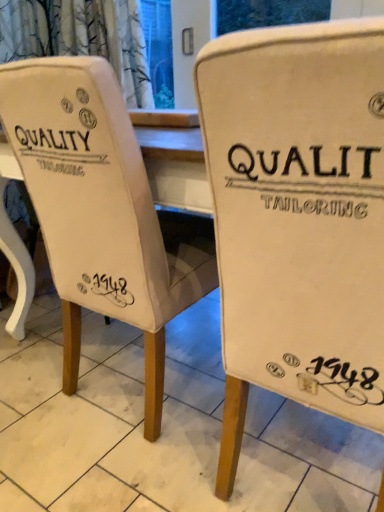
Question: Is white fabric chair at center, the second chair viewed from the right, positioned beyond the bounds of beige fabric chair at center, the first chair from the right?

Choices:
 (A) yes
 (B) no

Answer: (A)

Question: Does white fabric chair at center, the first chair in the left-to-right sequence, turn towards beige fabric chair at center, the first chair from the right?

Choices:
 (A) no
 (B) yes

Answer: (A)

Question: Can you confirm if white fabric chair at center, the second chair viewed from the right, is thinner than beige fabric chair at center, the first chair from the right?

Choices:
 (A) no
 (B) yes

Answer: (B)

Question: From the image's perspective, would you say white fabric chair at center, the second chair viewed from the right, is positioned over beige fabric chair at center, which is counted as the second chair, starting from the left?

Choices:
 (A) yes
 (B) no

Answer: (A)

Question: Is white fabric chair at center, the second chair viewed from the right, positioned with its back to beige fabric chair at center, the first chair from the right?

Choices:
 (A) yes
 (B) no

Answer: (B)

Question: Does white fabric chair at center, the first chair in the left-to-right sequence, lie in front of white canvas chair at center?

Choices:
 (A) no
 (B) yes

Answer: (A)

Question: Is white fabric chair at center, the second chair viewed from the right, not inside white canvas chair at center?

Choices:
 (A) yes
 (B) no

Answer: (A)

Question: Considering the relative sizes of white fabric chair at center, the first chair in the left-to-right sequence, and white canvas chair at center in the image provided, is white fabric chair at center, the first chair in the left-to-right sequence, thinner than white canvas chair at center?

Choices:
 (A) no
 (B) yes

Answer: (B)

Question: Considering the relative sizes of white fabric chair at center, the second chair viewed from the right, and white canvas chair at center in the image provided, is white fabric chair at center, the second chair viewed from the right, bigger than white canvas chair at center?

Choices:
 (A) yes
 (B) no

Answer: (A)

Question: Considering the relative sizes of white fabric chair at center, the first chair in the left-to-right sequence, and white canvas chair at center in the image provided, is white fabric chair at center, the first chair in the left-to-right sequence, taller than white canvas chair at center?

Choices:
 (A) yes
 (B) no

Answer: (A)

Question: Is white fabric chair at center, the first chair in the left-to-right sequence, turned away from white canvas chair at center?

Choices:
 (A) no
 (B) yes

Answer: (A)

Question: Considering the relative positions of white canvas chair at center and white fabric chair at center, the second chair viewed from the right, in the image provided, is white canvas chair at center to the right of white fabric chair at center, the second chair viewed from the right, from the viewer's perspective?

Choices:
 (A) yes
 (B) no

Answer: (B)